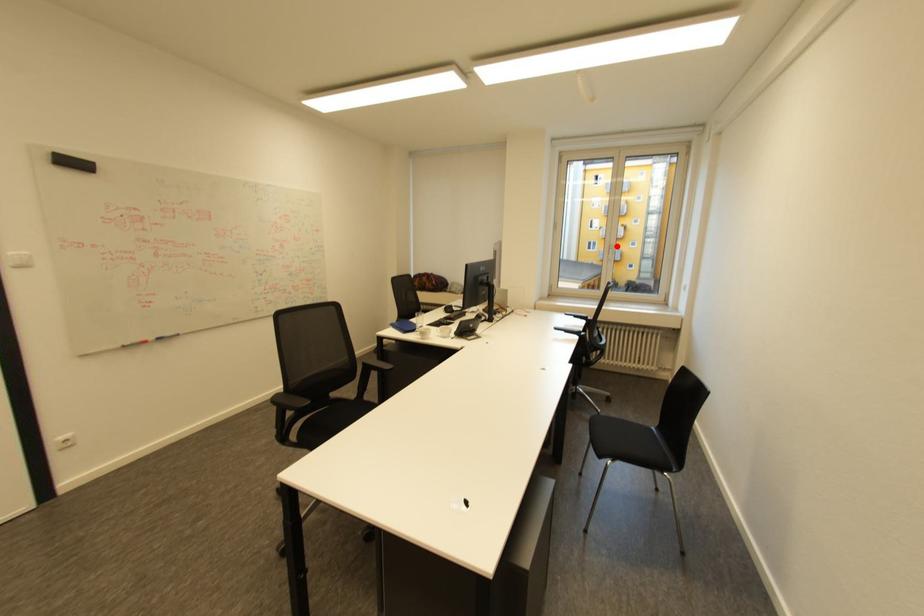
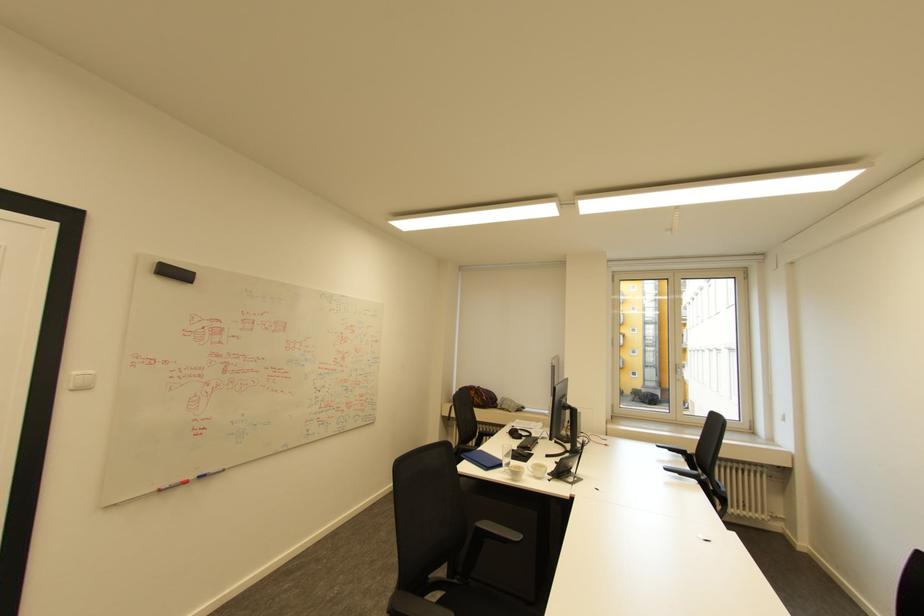
Locate, in the second image, the point that corresponds to the highlighted location in the first image.

(683, 365)